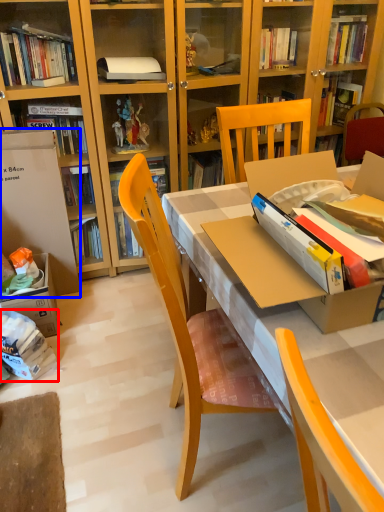
Question: Which of the following is the closest to the observer, book (highlighted by a red box) or leftover (highlighted by a blue box)?

Choices:
 (A) book
 (B) leftover

Answer: (A)